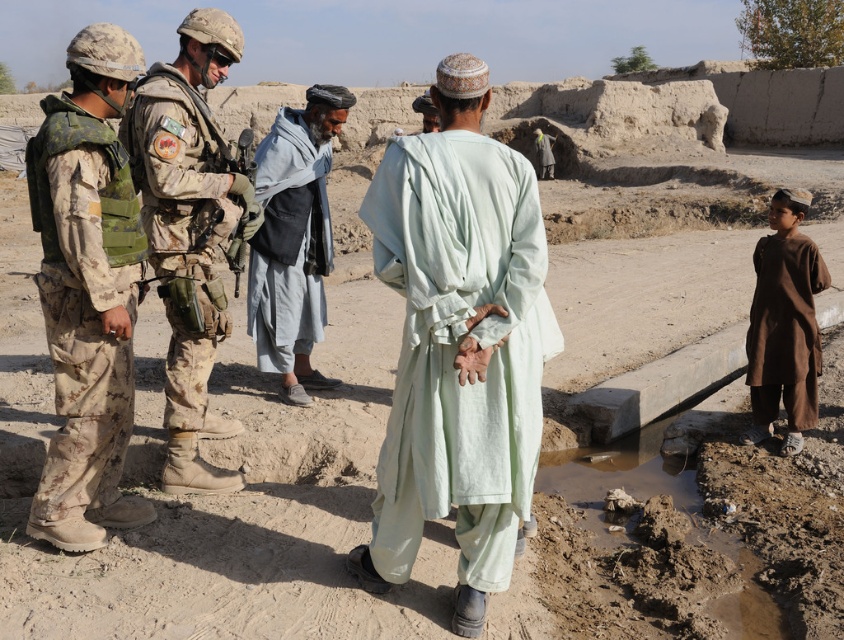
You are a drone operator tasked with identifying the position of the camouflage fabric uniform at center in the image. According to the coordinates provided, where exactly is this uniform located?

The camouflage fabric uniform at center is located at point (x=188, y=230).

You are a photographer trying to capture a detailed shot of the camouflage fabric robe at left without including the soldiers or local men in the image. Given their positions, is it possible to frame the scene such that the robe is visible while excluding the other figures?

The camouflage fabric robe at left is located at point (84,305). Since the soldiers and local men are positioned in the foreground engaged in conversation, it is possible to adjust the camera angle or zoom to focus on the robe at the specified coordinates while excluding the other figures from the frame.

You are a photographer standing in the scene and want to take a photo that includes both the light green fabric at center and the camouflage fabric robe at left. Which object should you focus on first to ensure both are in clear view?

You should focus on the light green fabric at center first because it is closer to the viewer than the camouflage fabric robe at left, ensuring both will be in focus when focusing on the closer object.